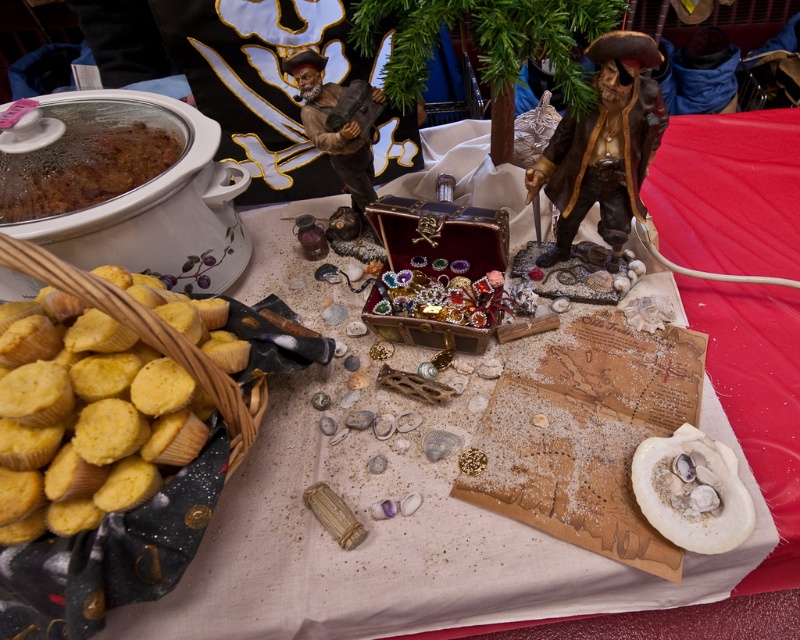
You are a pirate searching for treasure on the table. You see the yellow paper muffins at lower left and the brown matte chili at upper left. Which object is closer to you?

The yellow paper muffins at lower left are closer to you because they are in front of the brown matte chili at upper left.

You are a treasure hunter looking at the pirate display. You notice the matte brown pirate at center and the brown matte chili at upper left. Which object is positioned higher up in the image?

The brown matte chili at upper left is positioned higher up in the image than the matte brown pirate at center.

You are a pirate searching for treasure in the pirate display. You see the brown matte chili at upper left and the matte brown wood pirate at center. Which item is located to the left of the pirate?

The brown matte chili at upper left is positioned on the left side of the matte brown wood pirate at center.